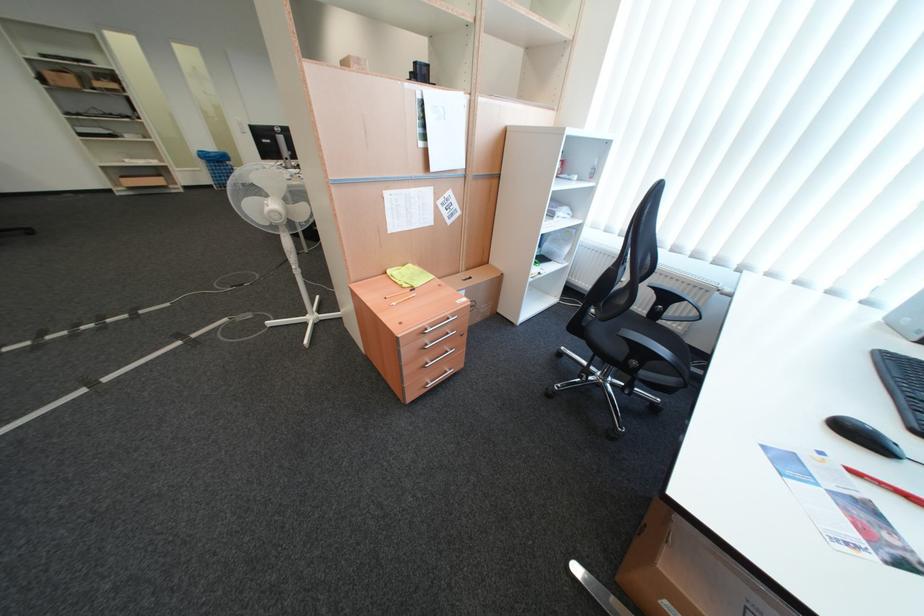
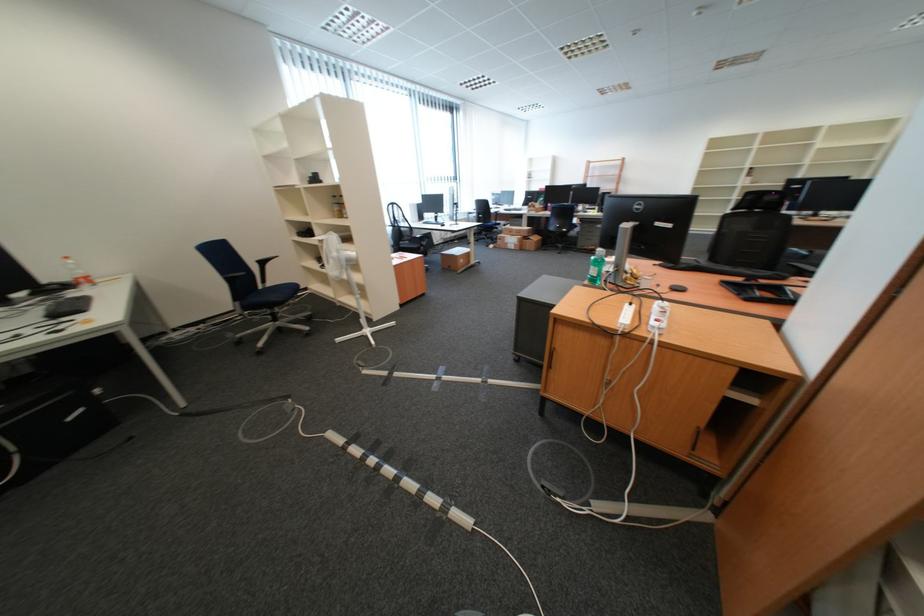
Question: I am providing you with two images of the same scene from different viewpoints. Please identify which objects are invisible in image2.

Choices:
 (A) plastic water bottle
 (B) stack of white paper
 (C) black keyboard
 (D) black mouse

Answer: (C)